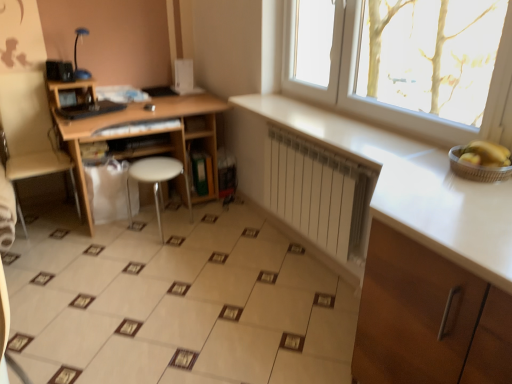
I want to click on vacant space situated on the left part of metallic silver basket at right, so [426, 174].